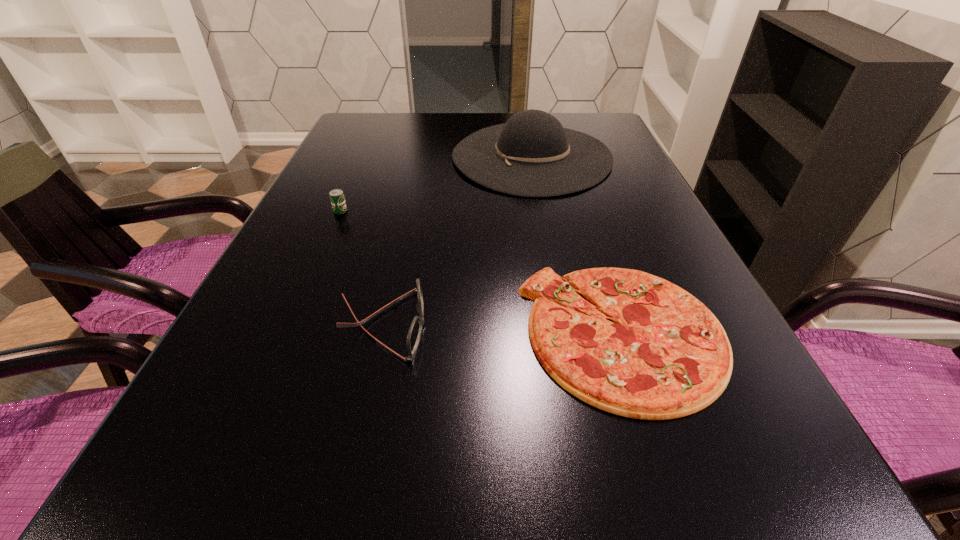
The image size is (960, 540). Find the location of `free space that satisfies the following two spatial constraints: 1. on the front-facing side of the shortest object; 2. on the right side of the tallest object`. free space that satisfies the following two spatial constraints: 1. on the front-facing side of the shortest object; 2. on the right side of the tallest object is located at coordinates (566, 333).

You are a GUI agent. You are given a task and a screenshot of the screen. Output one action in this format:
    pyautogui.click(x=<x>, y=<y>)
    Task: Click on the vacant space that satisfies the following two spatial constraints: 1. on the front-facing side of the sombrero; 2. on the right side of the pizza
    
    Given the screenshot: What is the action you would take?
    pyautogui.click(x=566, y=333)